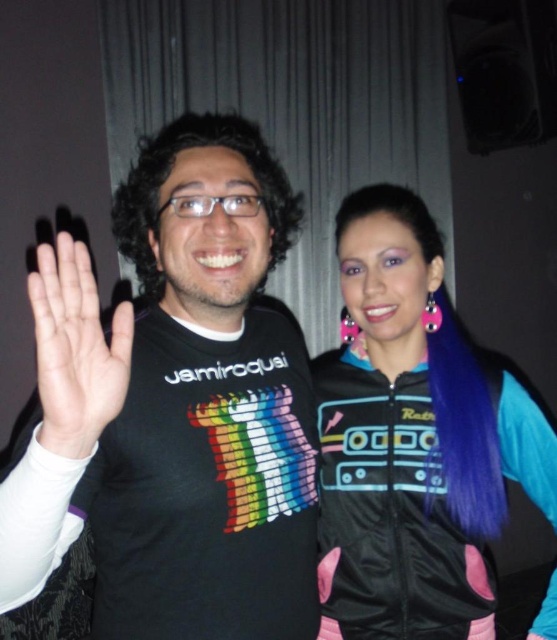
You are a photographer setting up a photo shoot with two subjects. You need to position a light source so that it illuminates both the white matte hand at center and the dark curly hair at center. Given their sizes, which object should you focus the light on first to ensure proper exposure?

The dark curly hair at center is taller than the white matte hand at center, so you should focus the light on the dark curly hair at center first to ensure proper exposure for the taller object.